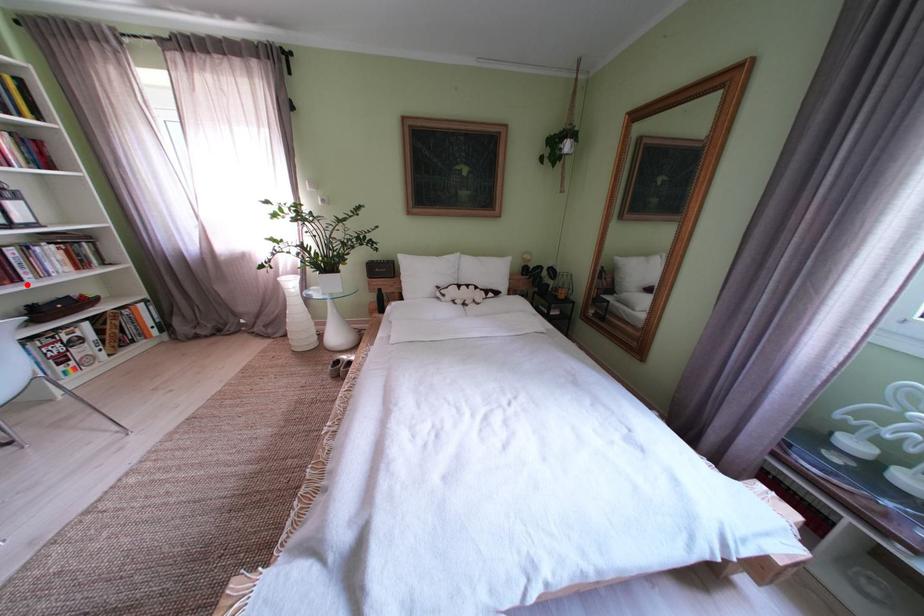
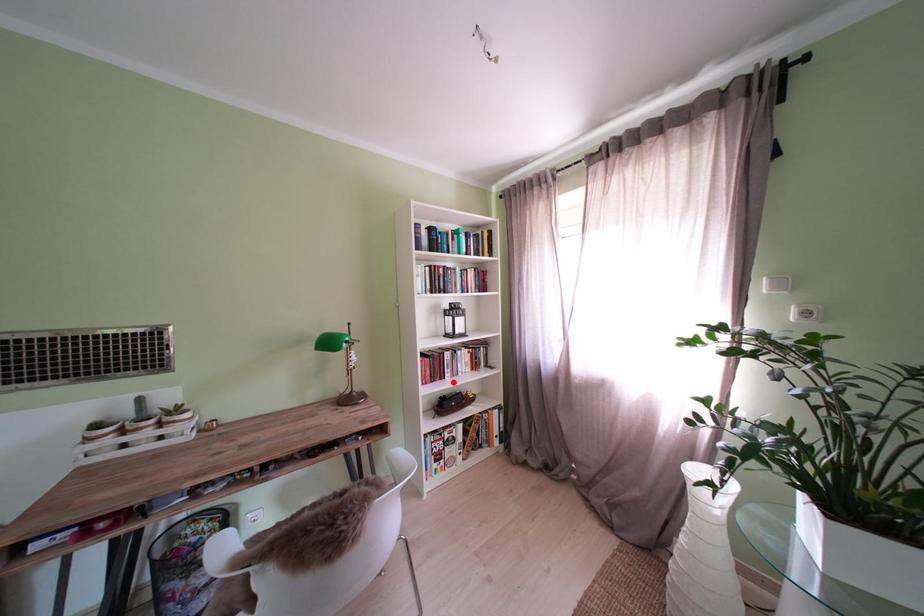
I am providing you with two images of the same scene from different viewpoints. A red point is marked on the first image and another point is marked on the second image. Are the points marked in image1 and image2 representing the same 3D position?

Yes